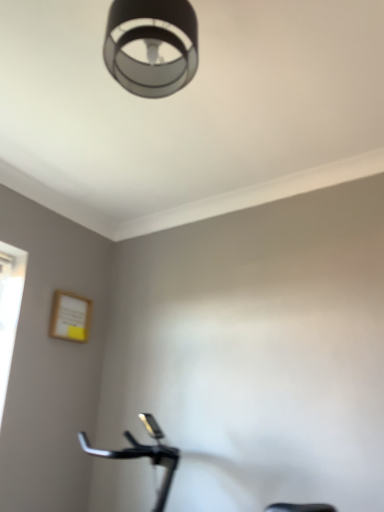
This screenshot has width=384, height=512. Describe the element at coordinates (151, 45) in the screenshot. I see `matte black lampshade at upper center` at that location.

Where is `matte black lampshade at upper center`? This screenshot has height=512, width=384. matte black lampshade at upper center is located at coordinates (151, 45).

Measure the distance between point (141, 54) and camera.

The distance of point (141, 54) from camera is 4.65 feet.

Describe the element at coordinates (144, 455) in the screenshot. This screenshot has width=384, height=512. I see `black matte stationary bicycle at lower center` at that location.

Where is `black matte stationary bicycle at lower center`? The height and width of the screenshot is (512, 384). black matte stationary bicycle at lower center is located at coordinates (144, 455).

This screenshot has height=512, width=384. I want to click on matte black lampshade at upper center, so click(151, 45).

Considering the relative positions of matte black lampshade at upper center and black matte stationary bicycle at lower center in the image provided, is matte black lampshade at upper center to the left of black matte stationary bicycle at lower center from the viewer's perspective?

Yes.

Considering their positions, is matte black lampshade at upper center located in front of or behind black matte stationary bicycle at lower center?

matte black lampshade at upper center is in front of black matte stationary bicycle at lower center.

Is point (148, 14) behind point (176, 451)?

No, (148, 14) is in front of (176, 451).

From the image's perspective, which is below, matte black lampshade at upper center or black matte stationary bicycle at lower center?

black matte stationary bicycle at lower center appears lower in the image.

From a real-world perspective, relative to black matte stationary bicycle at lower center, is matte black lampshade at upper center vertically above or below?

matte black lampshade at upper center is above black matte stationary bicycle at lower center.

Is matte black lampshade at upper center wider than black matte stationary bicycle at lower center?

Incorrect, the width of matte black lampshade at upper center does not surpass that of black matte stationary bicycle at lower center.

Is matte black lampshade at upper center taller than black matte stationary bicycle at lower center?

No.

Is matte black lampshade at upper center bigger or smaller than black matte stationary bicycle at lower center?

matte black lampshade at upper center is smaller than black matte stationary bicycle at lower center.

Is matte black lampshade at upper center not inside black matte stationary bicycle at lower center?

matte black lampshade at upper center lies outside black matte stationary bicycle at lower center's area.

Does matte black lampshade at upper center touch black matte stationary bicycle at lower center?

No, matte black lampshade at upper center is not next to black matte stationary bicycle at lower center.

From the picture: Could you tell me if matte black lampshade at upper center is turned towards black matte stationary bicycle at lower center?

No, matte black lampshade at upper center does not turn towards black matte stationary bicycle at lower center.

Can you tell me how much matte black lampshade at upper center and black matte stationary bicycle at lower center differ in facing direction?

There is a 88.8-degree angle between the facing directions of matte black lampshade at upper center and black matte stationary bicycle at lower center.

I want to click on stationary bicycle on the right of matte black lampshade at upper center, so click(x=144, y=455).

Considering the relative positions of black matte stationary bicycle at lower center and matte black lampshade at upper center in the image provided, is black matte stationary bicycle at lower center to the left of matte black lampshade at upper center from the viewer's perspective?

No.

Is black matte stationary bicycle at lower center closer to the viewer compared to matte black lampshade at upper center?

No, it is not.

Is point (156, 481) farther from viewer compared to point (155, 13)?

Yes, it is.

From the image's perspective, does black matte stationary bicycle at lower center appear lower than matte black lampshade at upper center?

Yes, from the image's perspective, black matte stationary bicycle at lower center is below matte black lampshade at upper center.

From a real-world perspective, which is physically above, black matte stationary bicycle at lower center or matte black lampshade at upper center?

matte black lampshade at upper center is physically above.

Which object is thinner, black matte stationary bicycle at lower center or matte black lampshade at upper center?

matte black lampshade at upper center.

Between black matte stationary bicycle at lower center and matte black lampshade at upper center, which one has less height?

matte black lampshade at upper center is shorter.

Considering the sizes of black matte stationary bicycle at lower center and matte black lampshade at upper center in the image, is black matte stationary bicycle at lower center bigger or smaller than matte black lampshade at upper center?

Considering their sizes, black matte stationary bicycle at lower center takes up more space than matte black lampshade at upper center.

Does black matte stationary bicycle at lower center contain matte black lampshade at upper center?

No, matte black lampshade at upper center is not surrounded by black matte stationary bicycle at lower center.

Is black matte stationary bicycle at lower center not near matte black lampshade at upper center?

Yes, black matte stationary bicycle at lower center and matte black lampshade at upper center are quite far apart.

In the scene shown: Does black matte stationary bicycle at lower center turn towards matte black lampshade at upper center?

No, black matte stationary bicycle at lower center is not aimed at matte black lampshade at upper center.

How different are the orientations of black matte stationary bicycle at lower center and matte black lampshade at upper center in degrees?

88.8 degrees separate the facing orientations of black matte stationary bicycle at lower center and matte black lampshade at upper center.

What are the coordinates of `stationary bicycle below the matte black lampshade at upper center (from a real-world perspective)` in the screenshot? It's located at (144, 455).

Find the location of `lamp that is above the black matte stationary bicycle at lower center (from a real-world perspective)`. lamp that is above the black matte stationary bicycle at lower center (from a real-world perspective) is located at coordinates (151, 45).

Locate an element on the screen. The height and width of the screenshot is (512, 384). stationary bicycle that appears behind the matte black lampshade at upper center is located at coordinates (144, 455).